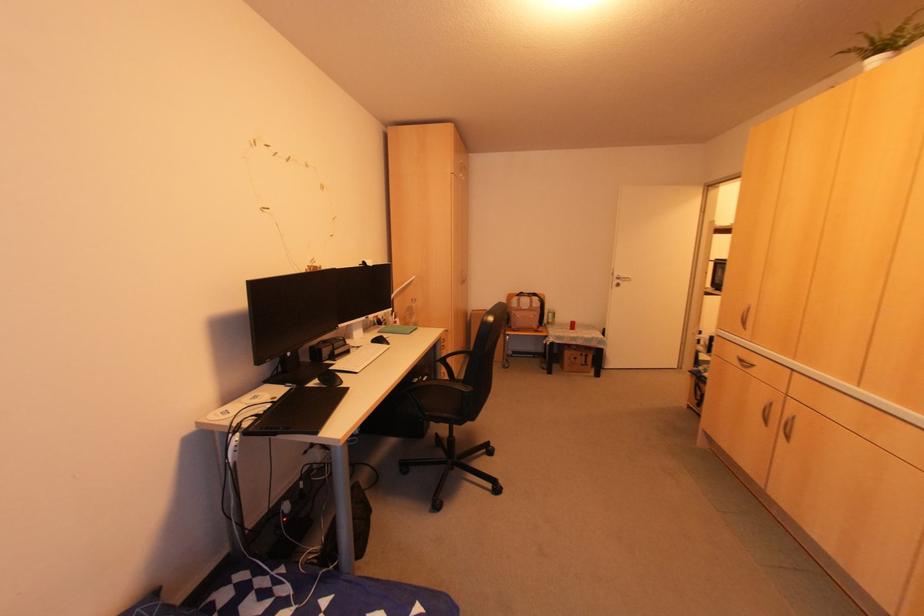
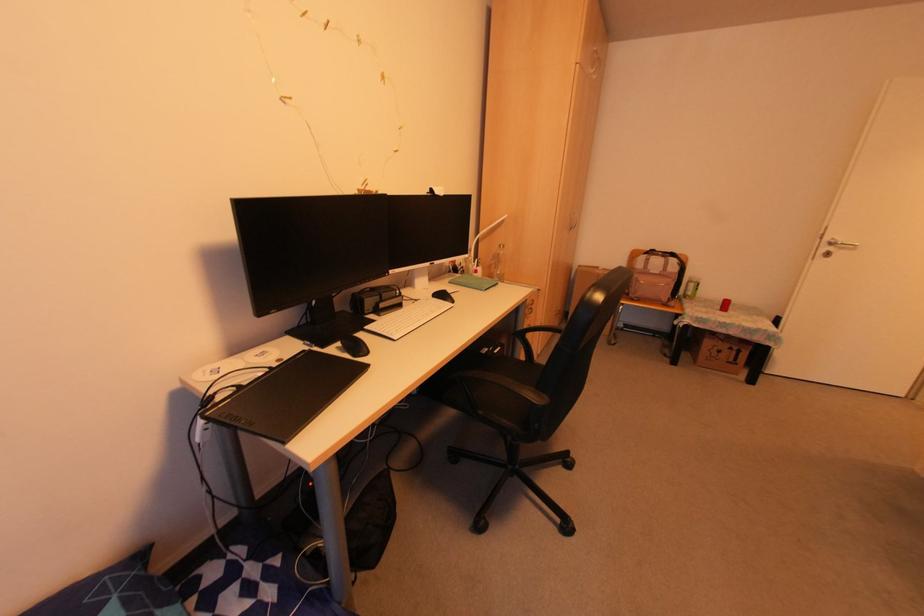
Find the pixel in the second image that matches point 578,354 in the first image.

(725, 346)